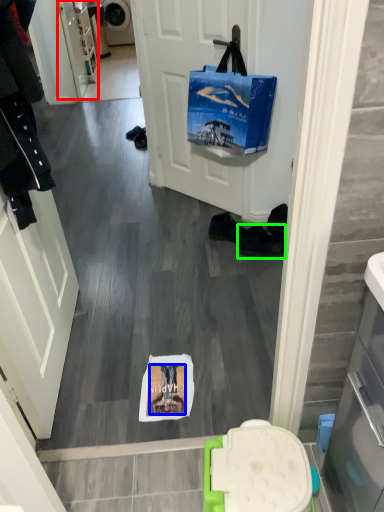
Question: Which object is positioned closest to cabinetry (highlighted by a red box)? Select from person (highlighted by a blue box) and footwear (highlighted by a green box).

Choices:
 (A) person
 (B) footwear

Answer: (B)